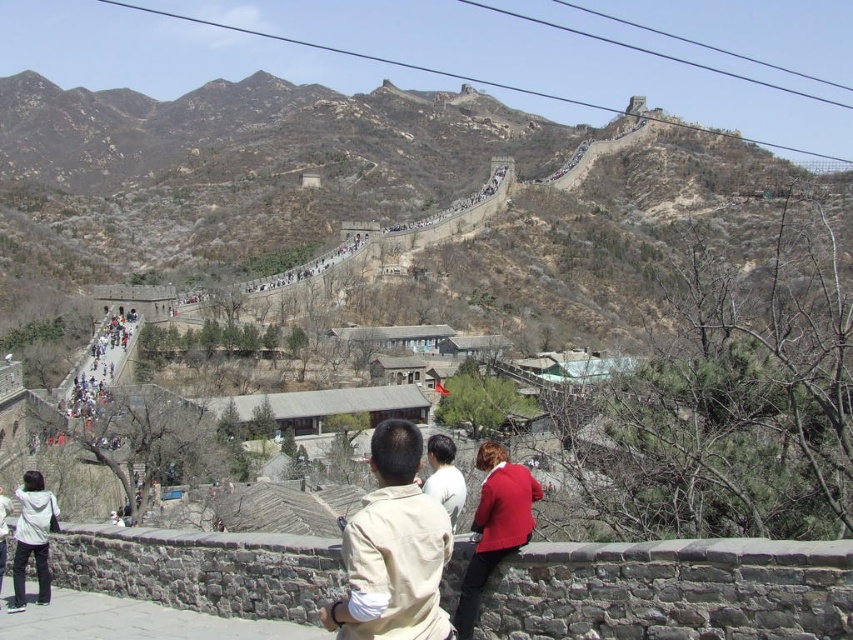
Question: Is red matte jacket at center to the right of white jacket at lower left from the viewer's perspective?

Choices:
 (A) yes
 (B) no

Answer: (A)

Question: Can you confirm if brown stone wall at upper center is positioned to the right of beige fabric shirt at center?

Choices:
 (A) no
 (B) yes

Answer: (A)

Question: Which point appears farthest from the camera in this image?

Choices:
 (A) (383, 140)
 (B) (390, 440)
 (C) (508, 484)
 (D) (22, 570)

Answer: (A)

Question: Which object is closer to the camera taking this photo?

Choices:
 (A) white jacket at lower left
 (B) red wool coat at center

Answer: (B)

Question: Which point is farther to the camera?

Choices:
 (A) tap(171, 237)
 (B) tap(27, 515)
 (C) tap(428, 448)
 (D) tap(512, 529)

Answer: (A)

Question: Does red matte jacket at center appear on the right side of white jacket at lower left?

Choices:
 (A) yes
 (B) no

Answer: (A)